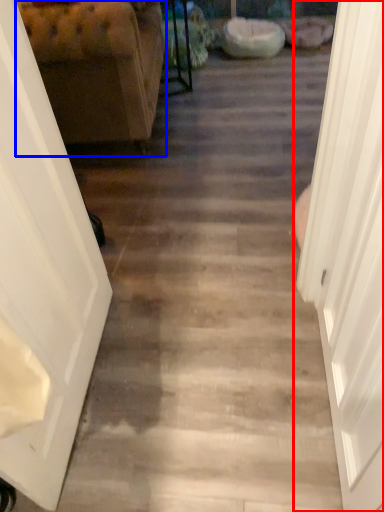
Question: Which object is further to the camera taking this photo, door (highlighted by a red box) or furniture (highlighted by a blue box)?

Choices:
 (A) door
 (B) furniture

Answer: (B)